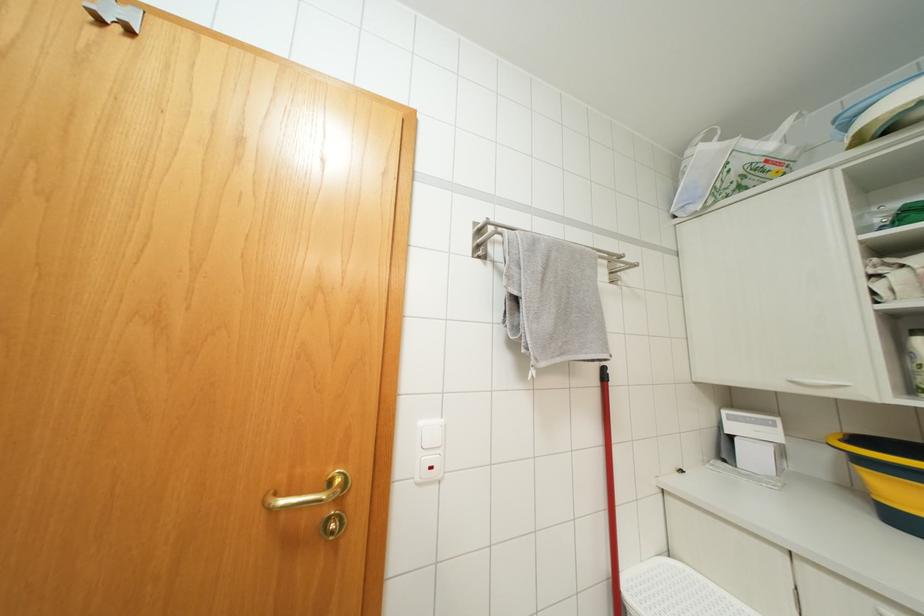
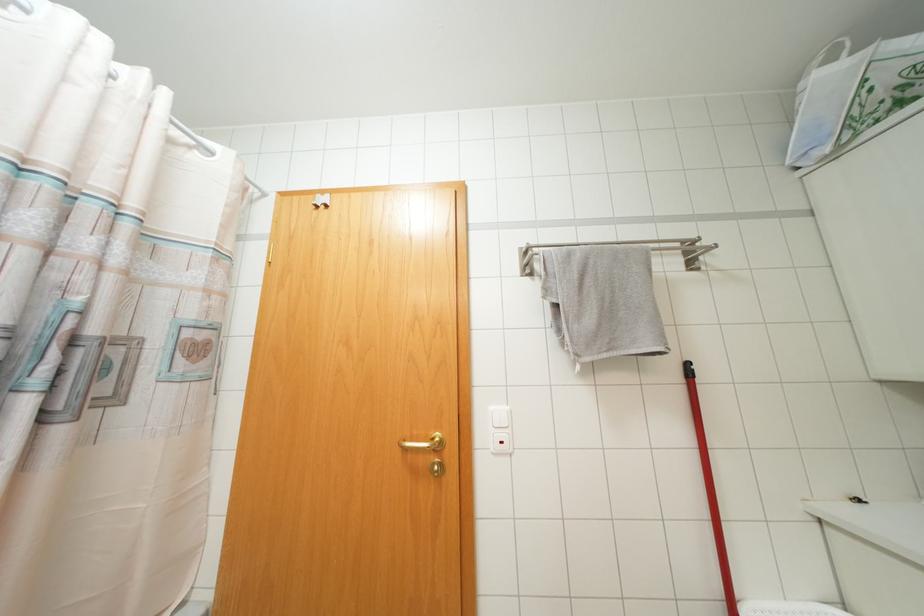
Question: The camera is either moving clockwise (left) or counter-clockwise (right) around the object. The first image is from the beginning of the video and the second image is from the end. Is the camera moving left or right when shooting the video?

Choices:
 (A) Left
 (B) Right

Answer: (B)